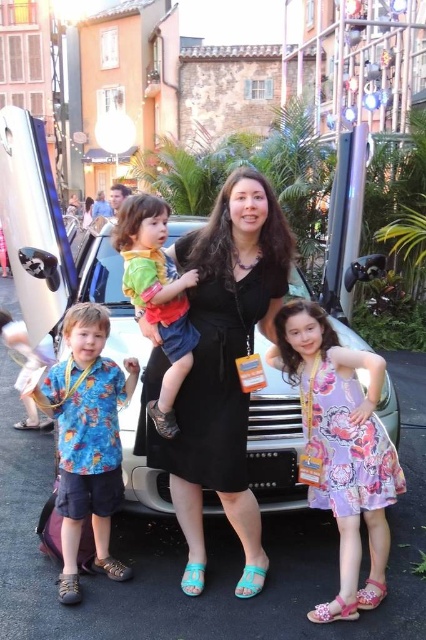
You are a photographer trying to capture a group photo of the woman in the black matte dress at center and the child in the matte green shirt at center. Since you want to ensure both are fully visible, which subject requires more space in the frame due to their clothing width?

The black matte dress at center has a greater width than the matte green shirt at center, so the photographer should allocate more space in the frame for the black matte dress at center to ensure it is fully visible.

You are standing in front of the vintage car and see the point at coordinates (342,448). What is the object located at that point?

The point at coordinates (342,448) corresponds to the floral dress at center.

You are a photographer standing 1.5 meters away from the camera. You want to adjust the focus on the blue printed shirt at center. Can you reach the camera without moving from your current position?

The blue printed shirt at center and camera are 2.41 meters apart. Since you are already 1.5 meters away from the camera, the total distance between you and the shirt is 2.41 meters minus your 1.5 meters position, but actually, the question is whether you can reach the camera from 1.5 meters to adjust it. Wait, perhaps the question needs clarification. Alternatively, maybe the distance between the shirt and the camera is 2.41 meters. If you are 1.5 meters from the camera, then the shirt is 2.41 meters away,